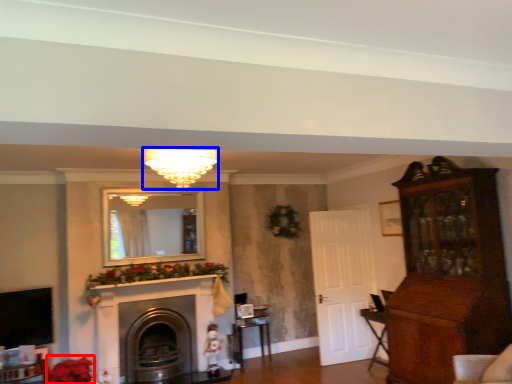
Question: Which object is further to the camera taking this photo, flower (highlighted by a red box) or light fixture (highlighted by a blue box)?

Choices:
 (A) flower
 (B) light fixture

Answer: (A)